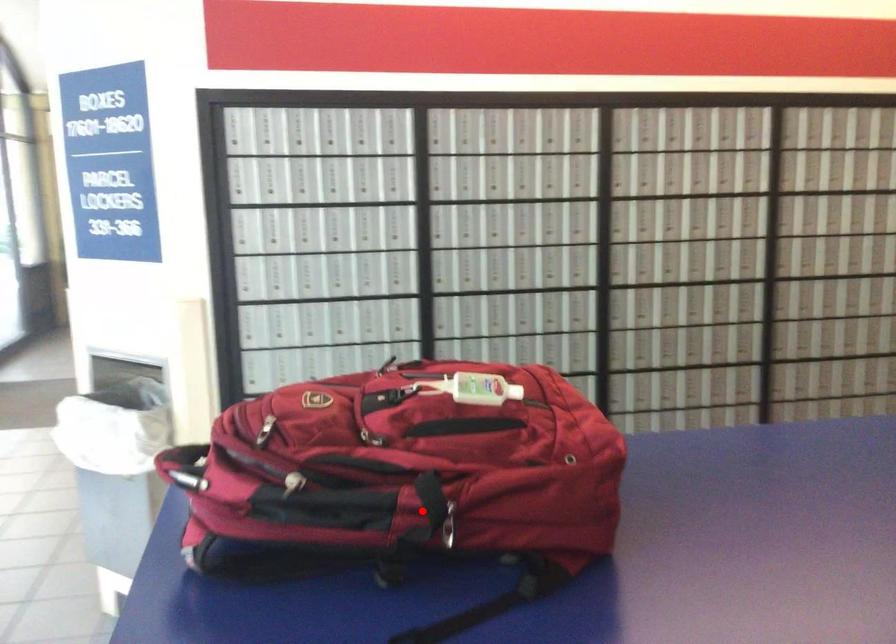
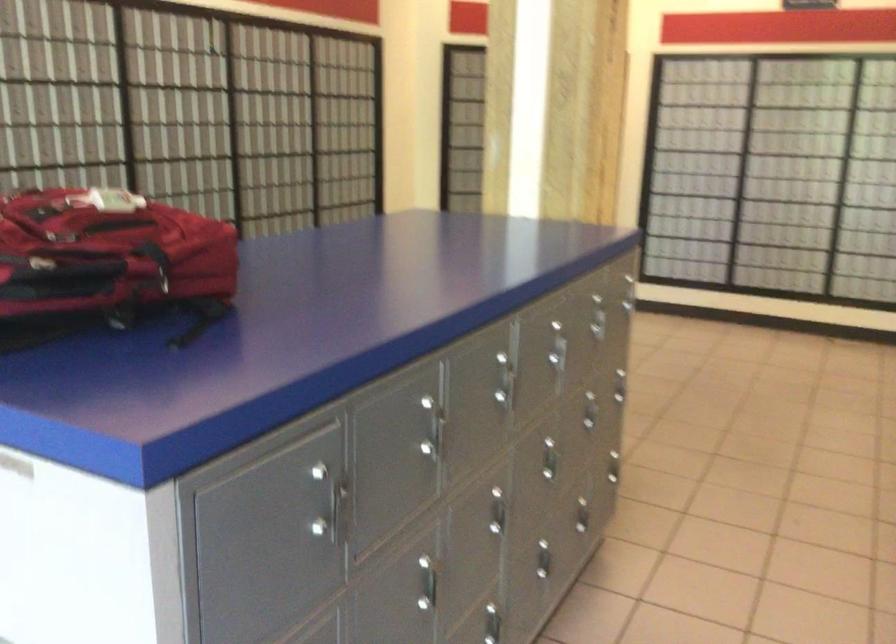
Question: I am providing you with two images of the same scene from different viewpoints. Image1 has a red point marked. In image2, the corresponding 3D location appears at what relative position? Reply with the corresponding letter.

Choices:
 (A) Closer
 (B) Farther

Answer: (B)